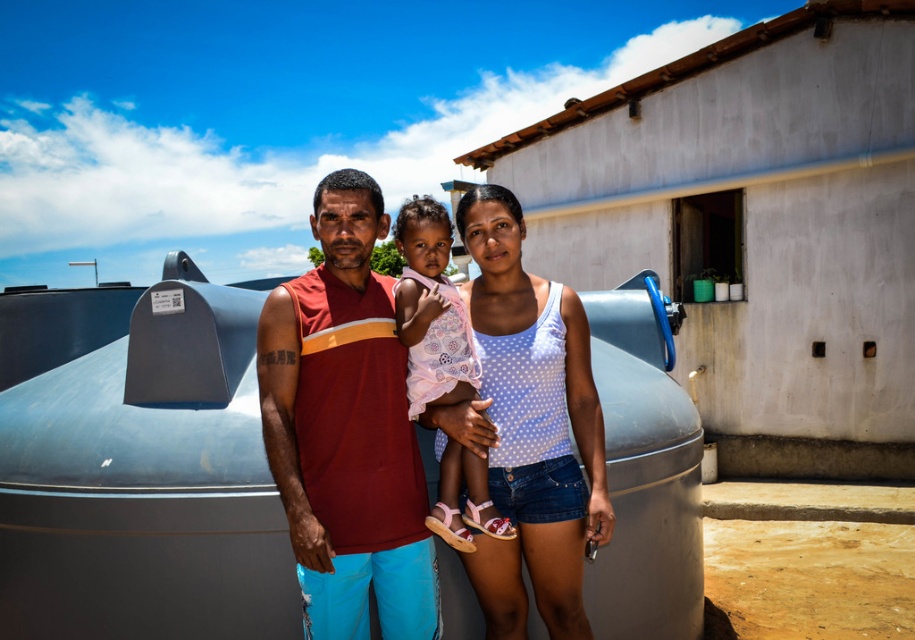
Is brushed metal water tank at center closer to camera compared to maroon sleeveless shirt at center?

No.

Based on the photo, who is lower down, brushed metal water tank at center or maroon sleeveless shirt at center?

brushed metal water tank at center is lower down.

Who is more distant from viewer, (249, 365) or (354, 556)?

The point (249, 365) is behind.

The width and height of the screenshot is (915, 640). I want to click on brushed metal water tank at center, so click(137, 465).

Is point (54, 564) farther from camera compared to point (528, 332)?

Yes.

Is brushed metal water tank at center positioned before white dotted tank top at center?

No.

Who is more distant from viewer, [4,298] or [483,314]?

The point [4,298] is behind.

This screenshot has width=915, height=640. Identify the location of brushed metal water tank at center. (137, 465).

Which is behind, point (483, 193) or point (405, 209)?

The point (483, 193) is more distant.

Is point (450, 426) in front of point (415, 272)?

That is True.

Locate an element on the screen. The width and height of the screenshot is (915, 640). white dotted tank top at center is located at coordinates (529, 426).